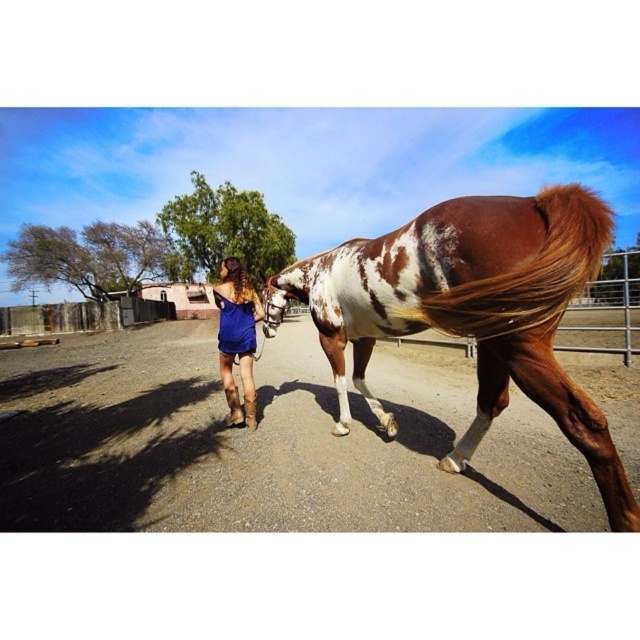
You are standing in the scene and want to move from the point at coordinates point (x=538, y=284) to the point at coordinates point (x=252, y=308). Which direction should you face to walk towards the second point?

To move from point (x=538, y=284) to point (x=252, y=308), you should face downward and to the right since the second point is located below and to the right of the first point.

You are a photographer positioned at the center of the frame. You want to capture a closeup of the brown silky tail at right. Which direction should you move your camera to focus on it?

The brown silky tail at right is located at point 0.425 on the x axis and 0.831 on the y axis. Since you are at the center of the frame, you should move your camera to the right and upwards to focus on it.